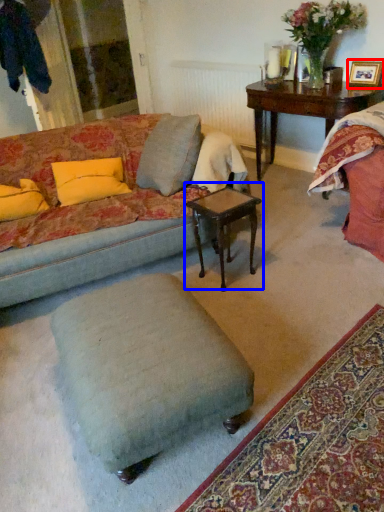
Question: Which of the following is the closest to the observer, picture frame (highlighted by a red box) or coffee table (highlighted by a blue box)?

Choices:
 (A) picture frame
 (B) coffee table

Answer: (B)